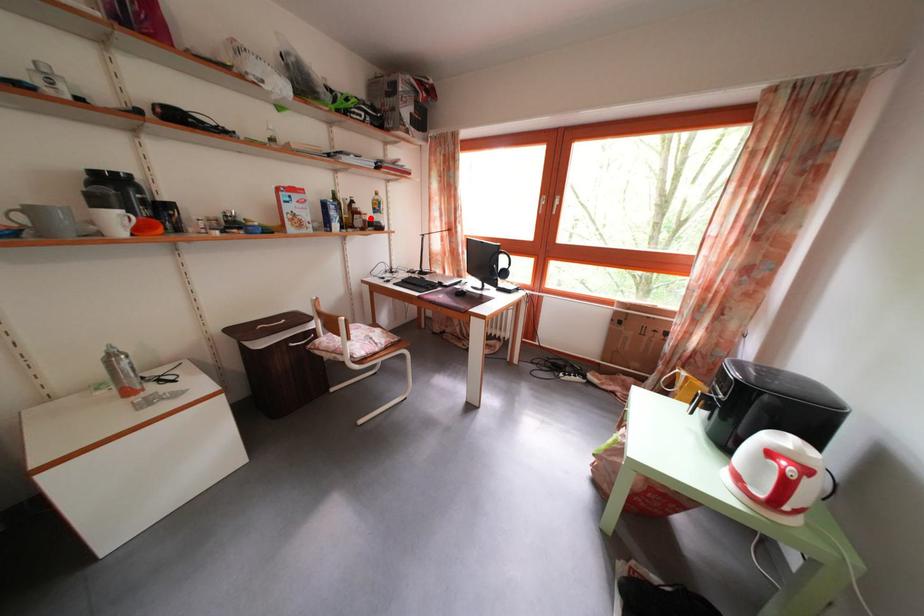
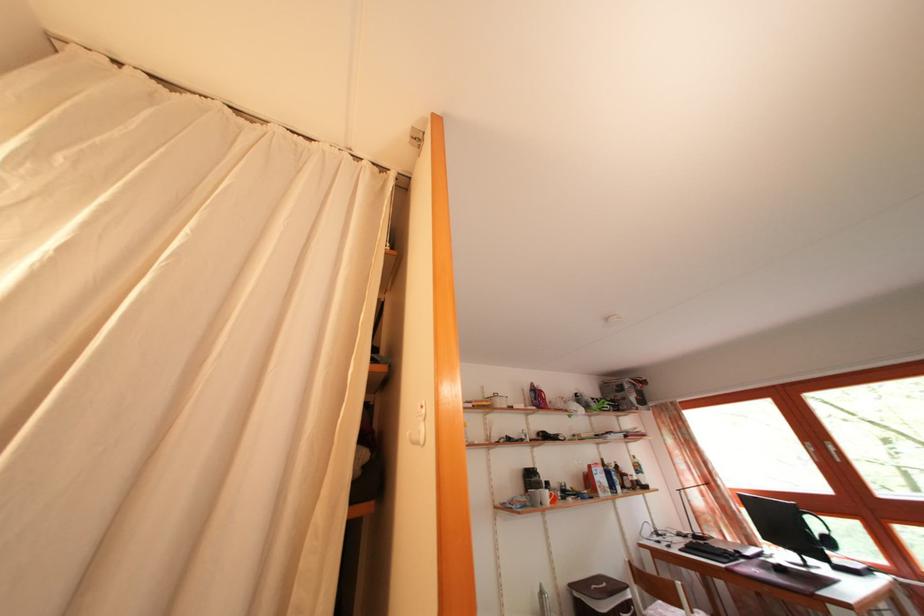
Question: I am providing you with two images of the same scene from different viewpoints. Given a red point in image1, look at the same physical point in image2. Is it:

Choices:
 (A) Closer to the viewpoint
 (B) Farther from the viewpoint

Answer: (B)